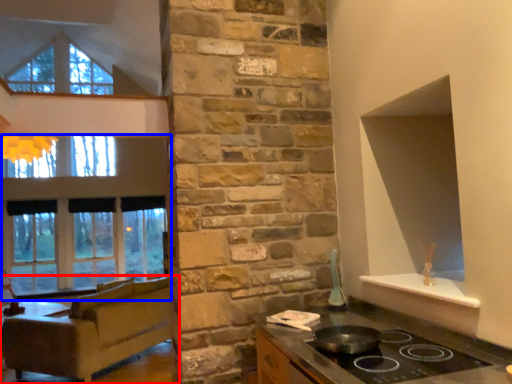
Question: Which object is further to the camera taking this photo, studio couch (highlighted by a red box) or window (highlighted by a blue box)?

Choices:
 (A) studio couch
 (B) window

Answer: (B)